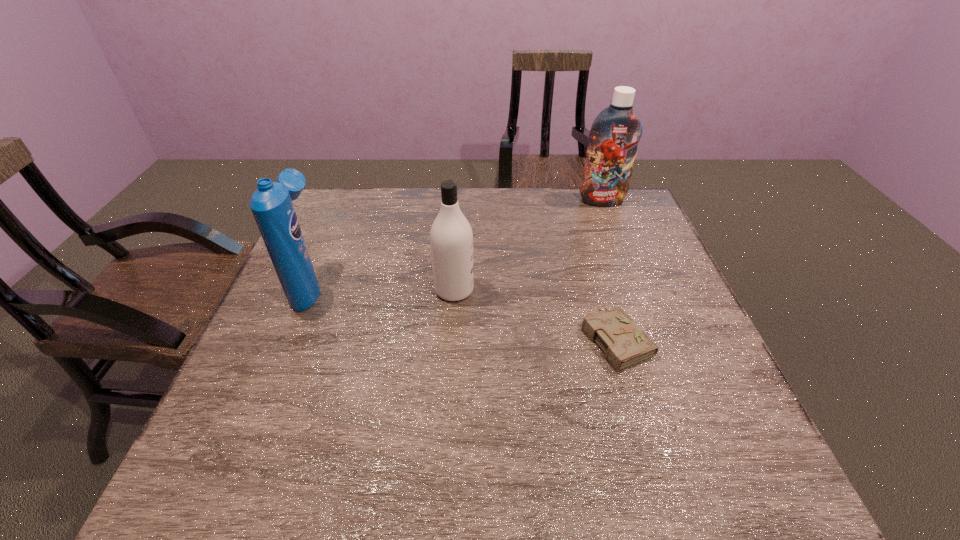
Locate an element on the screen. free point between the diary and the farthest shampoo is located at coordinates (609, 269).

This screenshot has width=960, height=540. What are the coordinates of `vacant area that lies between the second shampoo from right to left and the leftmost object` in the screenshot? It's located at (382, 288).

Image resolution: width=960 pixels, height=540 pixels. In order to click on vacant space that is in between the farthest shampoo and the second shampoo from right to left in this screenshot , I will do `click(528, 245)`.

Where is `unoccupied position between the rightmost shampoo and the shortest object`? This screenshot has width=960, height=540. unoccupied position between the rightmost shampoo and the shortest object is located at coordinates (609, 269).

Identify the location of free space between the second shampoo from right to left and the rightmost shampoo. (528, 245).

Find the location of `unoccupied position between the second shampoo from right to left and the farthest object`. unoccupied position between the second shampoo from right to left and the farthest object is located at coordinates (528, 245).

Locate an element on the screen. object that ranks as the closest to the diary is located at coordinates (451, 238).

Locate an element on the screen. The height and width of the screenshot is (540, 960). the closest object to the third object from right to left is located at coordinates (625, 344).

Point out which shampoo is positioned as the third nearest to the diary. Please provide its 2D coordinates. Your answer should be formatted as a tuple, i.e. [(x, y)], where the tuple contains the x and y coordinates of a point satisfying the conditions above.

[(271, 203)]

Identify which shampoo is the second nearest to the leftmost shampoo. Please provide its 2D coordinates. Your answer should be formatted as a tuple, i.e. [(x, y)], where the tuple contains the x and y coordinates of a point satisfying the conditions above.

[(614, 135)]